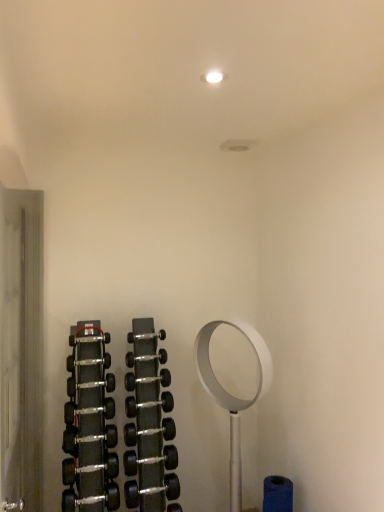
Question: Visually, is black rubber dumbbell at center, which is the 6th dumbbell from top to bottom, positioned to the left or to the right of black rubber dumbbell at lower left, which appears as the 2th dumbbell when ordered from the bottom?

Choices:
 (A) right
 (B) left

Answer: (A)

Question: Is black rubber dumbbell at center, which is the 6th dumbbell from top to bottom, taller or shorter than black rubber dumbbell at lower left, which is the seventh dumbbell from top to bottom?

Choices:
 (A) short
 (B) tall

Answer: (A)

Question: Estimate the real-world distances between objects in this image. Which object is farther from the black metallic dumbbell at center, marked as the first dumbbell in a top-to-bottom arrangement?

Choices:
 (A) transparent wood glass door at left
 (B) black rubber dumbbell at lower left, which appears as the 2th dumbbell when ordered from the bottom
 (C) black metallic dumbbell at center, which is the eighth dumbbell in top-to-bottom order
 (D) black rubber dumbbell at center, the third dumbbell from the top
 (E) black rubber dumbbell at center, marked as the second dumbbell in a top-to-bottom arrangement

Answer: (C)

Question: Which object is the closest to the transparent wood glass door at left?

Choices:
 (A) black rubber dumbbell at lower left, which is the seventh dumbbell from top to bottom
 (B) black rubber dumbbell at center, which is the 6th dumbbell in bottom-to-top order
 (C) black rubber dumbbell at center, which is the fifth dumbbell in bottom-to-top order
 (D) black rubber dumbbell at left, arranged as the fifth dumbbell when viewed from the top
 (E) black metallic dumbbell at center, the first dumbbell positioned from the bottom

Answer: (B)